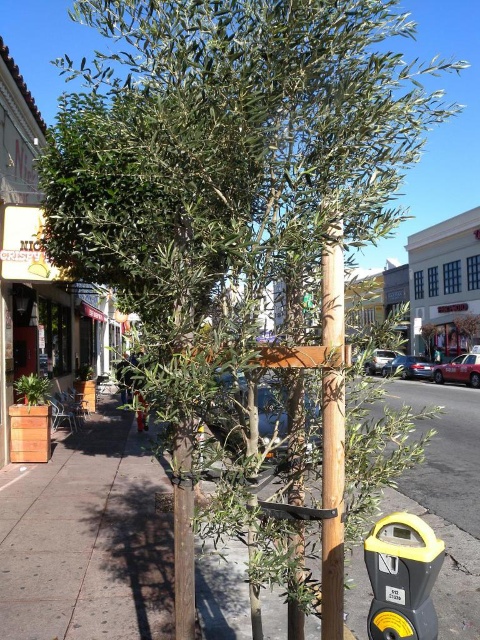
Question: Does wooden pole at center appear on the right side of yellow plastic parking meter at lower right?

Choices:
 (A) yes
 (B) no

Answer: (B)

Question: Among these objects, which one is farthest from the camera?

Choices:
 (A) brown wooden pole at center
 (B) wooden pole at center

Answer: (A)

Question: Estimate the real-world distances between objects in this image. Which object is closer to the brown wooden pole at center?

Choices:
 (A) wooden pole at center
 (B) yellow plastic parking meter at lower right

Answer: (B)

Question: Observing the image, what is the correct spatial positioning of brown wooden pole at center in reference to wooden pole at center?

Choices:
 (A) below
 (B) above

Answer: (A)

Question: Does wooden pole at center have a greater width compared to yellow plastic parking meter at lower right?

Choices:
 (A) no
 (B) yes

Answer: (A)

Question: Which of the following is the farthest from the observer?

Choices:
 (A) (322, 268)
 (B) (385, 570)
 (C) (466, 576)

Answer: (C)